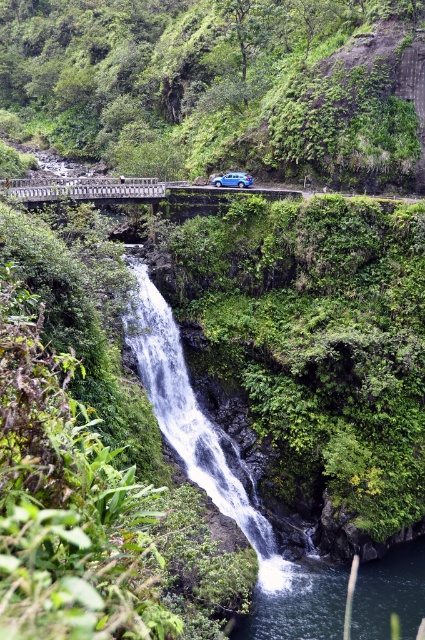
Question: Does green leafy vegetation at center have a greater width compared to white metal bridge at center?

Choices:
 (A) yes
 (B) no

Answer: (A)

Question: Which point is farther to the camera?

Choices:
 (A) white metal bridge at center
 (B) clear water at lower center

Answer: (A)

Question: Which object is closer to the camera taking this photo?

Choices:
 (A) white smooth waterfall at center
 (B) clear water at lower center
 (C) white metal bridge at center

Answer: (B)

Question: Which object is closer to the camera taking this photo?

Choices:
 (A) white metal bridge at center
 (B) clear water at lower center

Answer: (B)

Question: Considering the relative positions of clear water at lower center and white metal bridge at center in the image provided, where is clear water at lower center located with respect to white metal bridge at center?

Choices:
 (A) left
 (B) right

Answer: (B)

Question: Is white smooth waterfall at center below clear water at lower center?

Choices:
 (A) no
 (B) yes

Answer: (A)